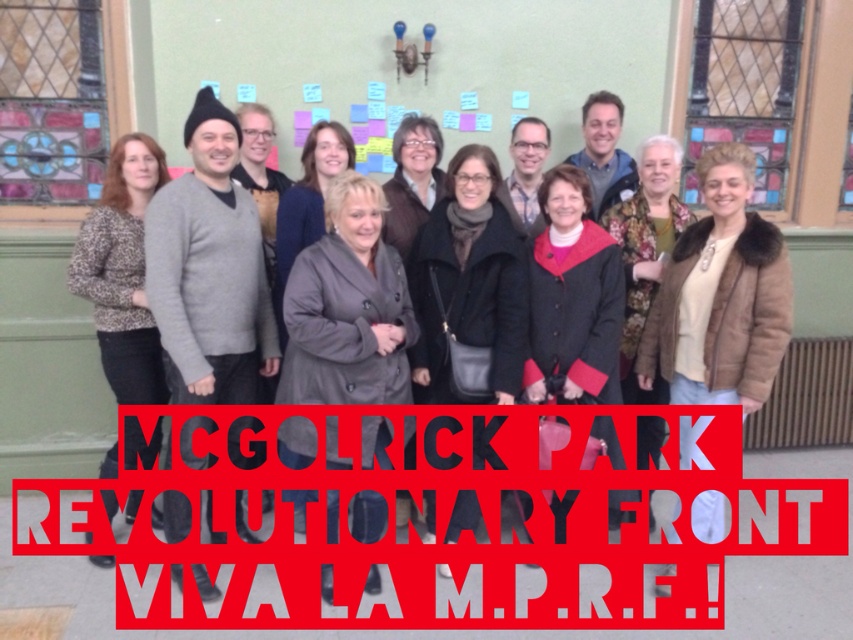
Question: Which of the following is the farthest from the observer?

Choices:
 (A) (397, 572)
 (B) (753, 244)

Answer: (A)

Question: Is black plastic sign at center below matte gray sweater at center?

Choices:
 (A) yes
 (B) no

Answer: (A)

Question: Among these points, which one is nearest to the camera?

Choices:
 (A) (502, 593)
 (B) (498, 273)

Answer: (B)

Question: Which object is closer to the camera taking this photo?

Choices:
 (A) black plastic sign at center
 (B) matte gray sweater at center

Answer: (B)

Question: From the image, what is the correct spatial relationship of black plastic sign at center in relation to matte gray sweater at center?

Choices:
 (A) below
 (B) above

Answer: (A)

Question: Is black plastic sign at center bigger than matte gray sweater at center?

Choices:
 (A) no
 (B) yes

Answer: (B)